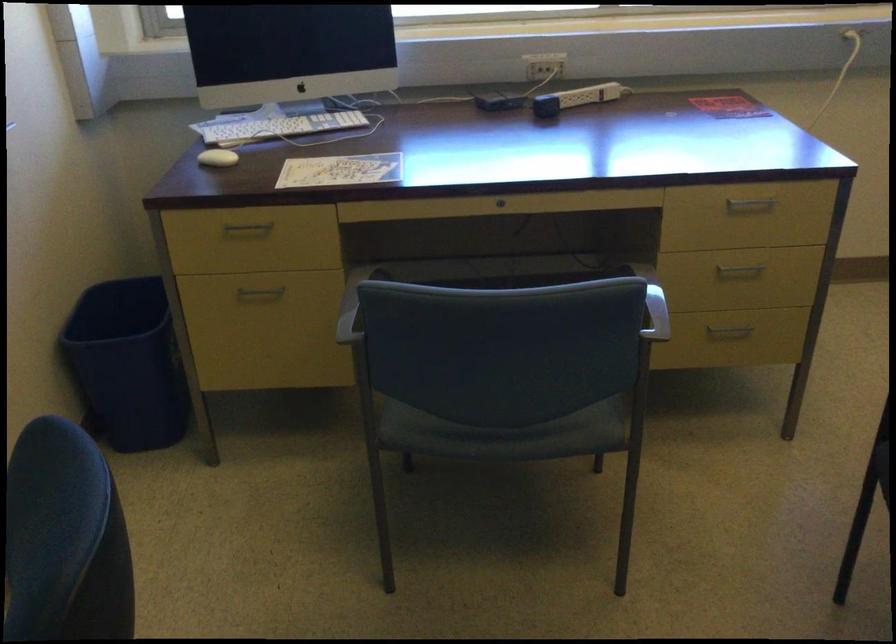
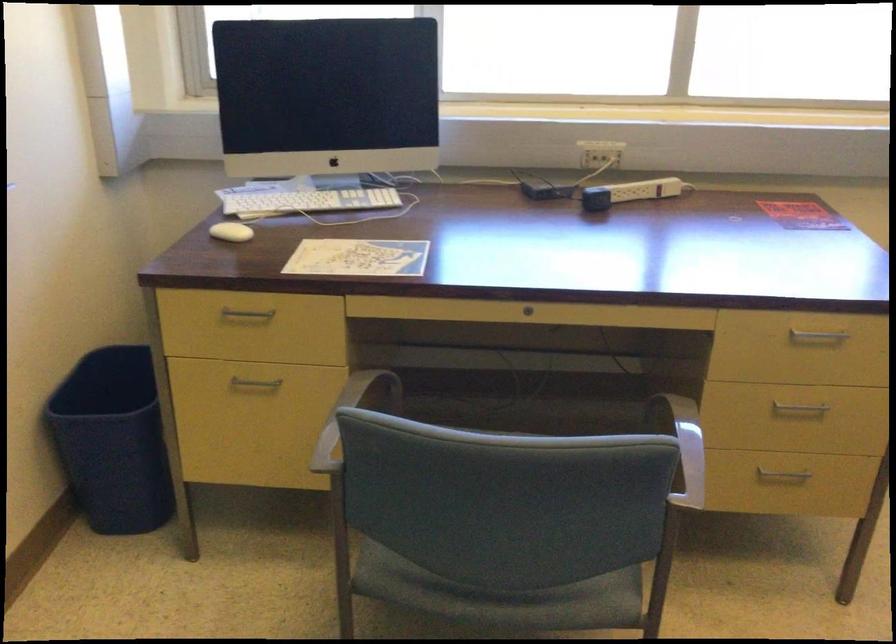
Find the pixel in the second image that matches (216,158) in the first image.

(230, 232)